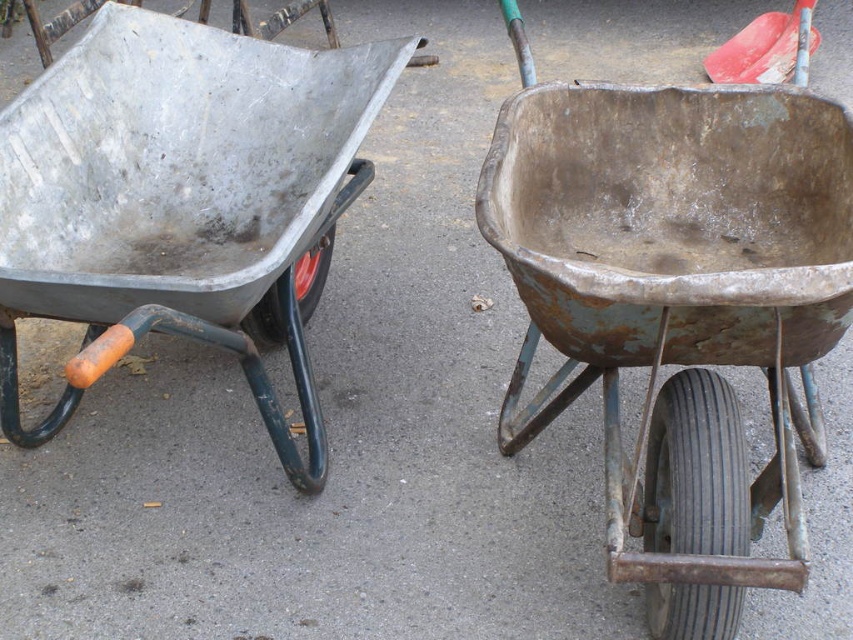
What do you see at coordinates (677, 305) in the screenshot? The height and width of the screenshot is (640, 853). I see `rusty metal wheelbarrow at center` at bounding box center [677, 305].

At what (x,y) coordinates should I click in order to perform the action: click on rusty metal wheelbarrow at center. Please return your answer as a coordinate pair (x, y). The image size is (853, 640). Looking at the image, I should click on (677, 305).

Is point (74, 252) positioned in front of point (720, 58)?

That is True.

Can you confirm if metallic gray wheelbarrow at left is positioned to the left of smooth red shovel at upper right?

Correct, you'll find metallic gray wheelbarrow at left to the left of smooth red shovel at upper right.

You are a GUI agent. You are given a task and a screenshot of the screen. Output one action in this format:
    pyautogui.click(x=<x>, y=<y>)
    Task: Click on the metallic gray wheelbarrow at left
    
    Given the screenshot: What is the action you would take?
    pyautogui.click(x=180, y=195)

Is rusty metal wheelbarrow at center taller than metallic gray wheelbarrow at left?

Yes.

Can you confirm if rusty metal wheelbarrow at center is thinner than metallic gray wheelbarrow at left?

Yes, rusty metal wheelbarrow at center is thinner than metallic gray wheelbarrow at left.

From the picture: Who is more forward, (717, 493) or (189, 205)?

Positioned in front is point (717, 493).

Locate an element on the screen. rusty metal wheelbarrow at center is located at coordinates tap(677, 305).